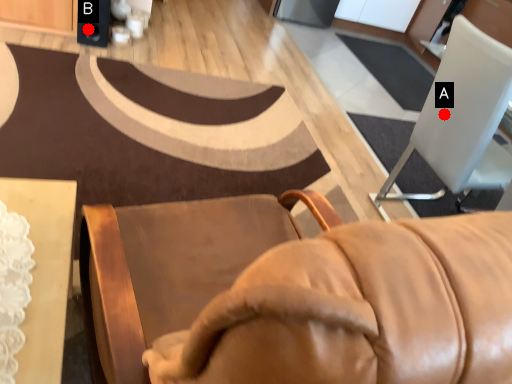
Question: Two points are circled on the image, labeled by A and B beside each circle. Which of the following is the farthest from the observer?

Choices:
 (A) A is further
 (B) B is further

Answer: (B)